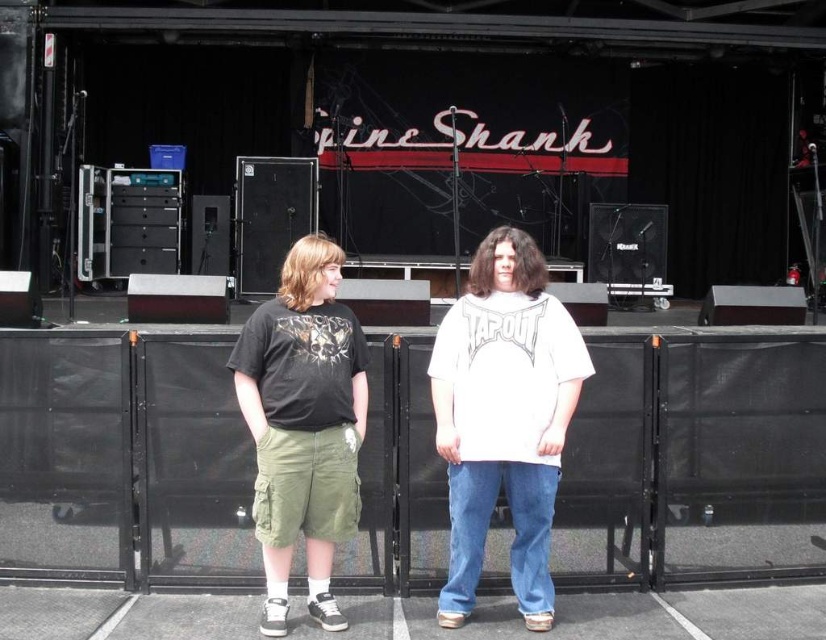
Question: Is white cotton shirt at center positioned in front of dark gray matte t-shirt at center?

Choices:
 (A) yes
 (B) no

Answer: (B)

Question: Which point is farther to the camera?

Choices:
 (A) white cotton shirt at center
 (B) dark gray matte t-shirt at center

Answer: (A)

Question: Which point is farther to the camera?

Choices:
 (A) (511, 227)
 (B) (328, 464)

Answer: (A)

Question: Does white cotton shirt at center have a lesser width compared to dark gray matte t-shirt at center?

Choices:
 (A) no
 (B) yes

Answer: (A)

Question: Is white cotton shirt at center below dark gray matte t-shirt at center?

Choices:
 (A) no
 (B) yes

Answer: (B)